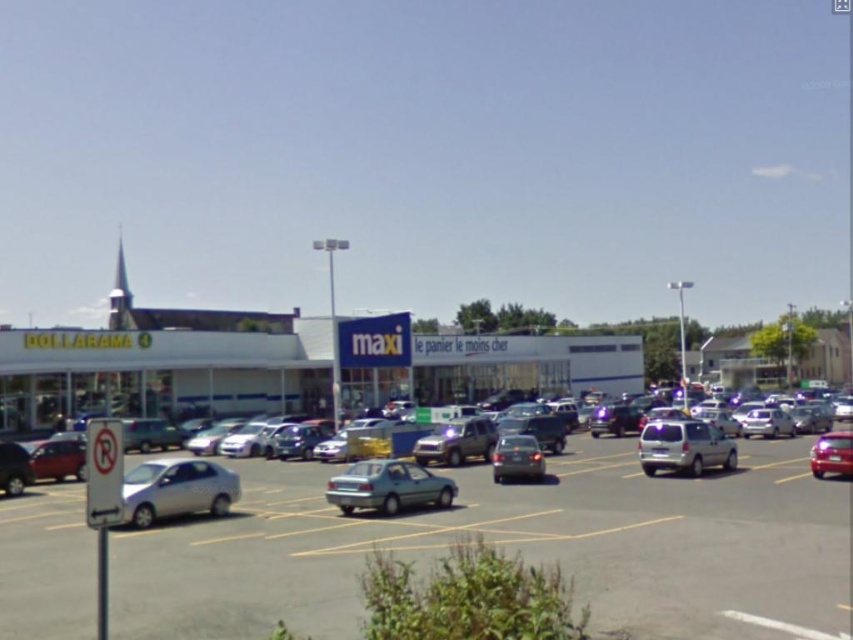
Question: Is silver metallic car at lower left above shiny red car at right?

Choices:
 (A) yes
 (B) no

Answer: (A)

Question: Can you confirm if metallic silver car at center is wider than silver metallic car at lower left?

Choices:
 (A) no
 (B) yes

Answer: (B)

Question: Which point is farther from the camera taking this photo?

Choices:
 (A) (445, 481)
 (B) (514, 474)
 (C) (230, 577)
 (D) (691, 442)

Answer: (D)

Question: Which object is positioned farthest from the green matte sedan at center?

Choices:
 (A) silver metallic car at lower left
 (B) metallic silver car at center

Answer: (A)

Question: Does metallic silver car at center appear over silver metallic suv at center-right?

Choices:
 (A) yes
 (B) no

Answer: (A)

Question: Considering the real-world distances, which object is farthest from the silver metallic car at lower left?

Choices:
 (A) metallic silver car at center
 (B) shiny red car at right
 (C) green matte sedan at center

Answer: (B)